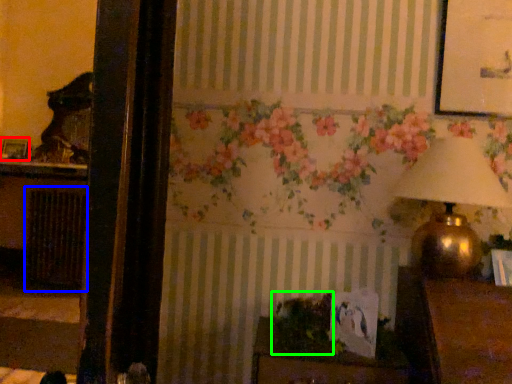
Question: Which object is the farthest from picture frame (highlighted by a red box)? Choose among these: radiator (highlighted by a blue box) or plant (highlighted by a green box).

Choices:
 (A) radiator
 (B) plant

Answer: (B)